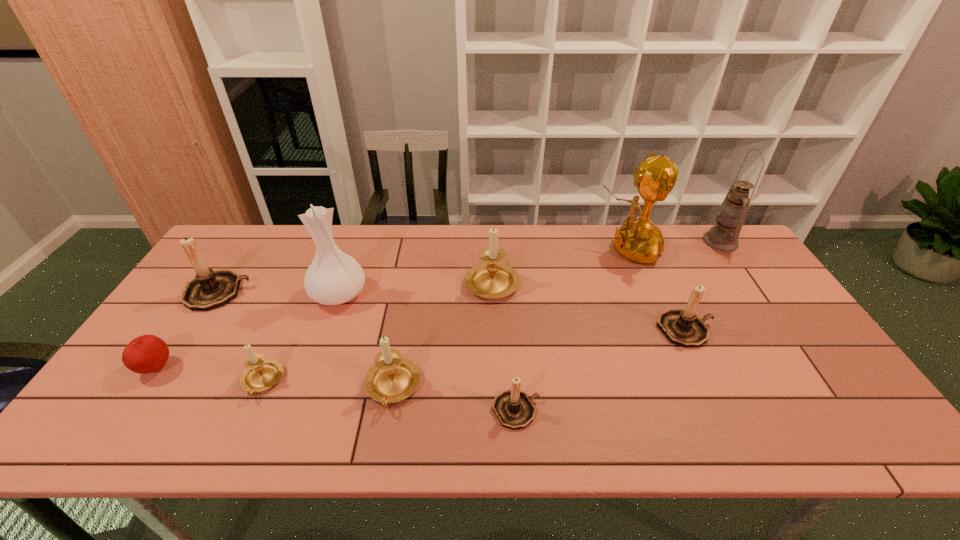
Identify which beige candle holder is the second nearest to the rightmost brown candle holder. Please provide its 2D coordinates. Your answer should be formatted as a tuple, i.e. [(x, y)], where the tuple contains the x and y coordinates of a point satisfying the conditions above.

[(393, 378)]

Identify which brown candle holder is located as the second nearest to the second biggest beige candle holder. Please provide its 2D coordinates. Your answer should be formatted as a tuple, i.e. [(x, y)], where the tuple contains the x and y coordinates of a point satisfying the conditions above.

[(210, 289)]

Find the location of a particular element. The width and height of the screenshot is (960, 540). brown candle holder identified as the closest to the eighth shortest object is located at coordinates (210, 289).

Where is `free location that satisfies the following two spatial constraints: 1. with a handle on the side of the smallest brown candle holder; 2. on the left side of the second candle holder from left to right`? The width and height of the screenshot is (960, 540). free location that satisfies the following two spatial constraints: 1. with a handle on the side of the smallest brown candle holder; 2. on the left side of the second candle holder from left to right is located at coordinates (250, 410).